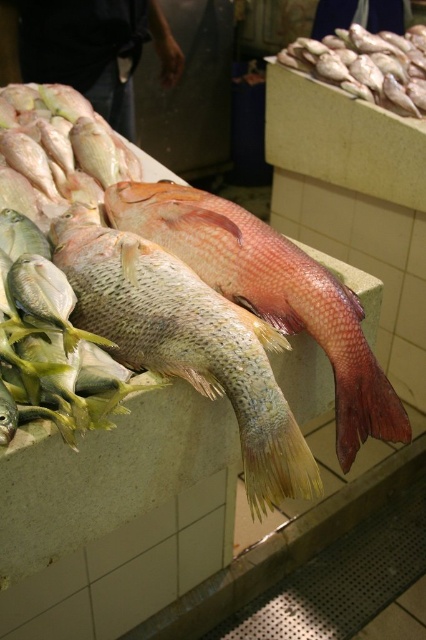
Is shiny pinkish-red fish at center in front of shiny silver fish at upper right?

Yes.

Does shiny pinkish-red fish at center appear under shiny silver fish at upper right?

Yes, shiny pinkish-red fish at center is below shiny silver fish at upper right.

This screenshot has height=640, width=426. What do you see at coordinates (270, 292) in the screenshot? I see `shiny pinkish-red fish at center` at bounding box center [270, 292].

You are a GUI agent. You are given a task and a screenshot of the screen. Output one action in this format:
    pyautogui.click(x=<x>, y=<y>)
    Task: Click on the shiny pinkish-red fish at center
    
    Given the screenshot: What is the action you would take?
    (270, 292)